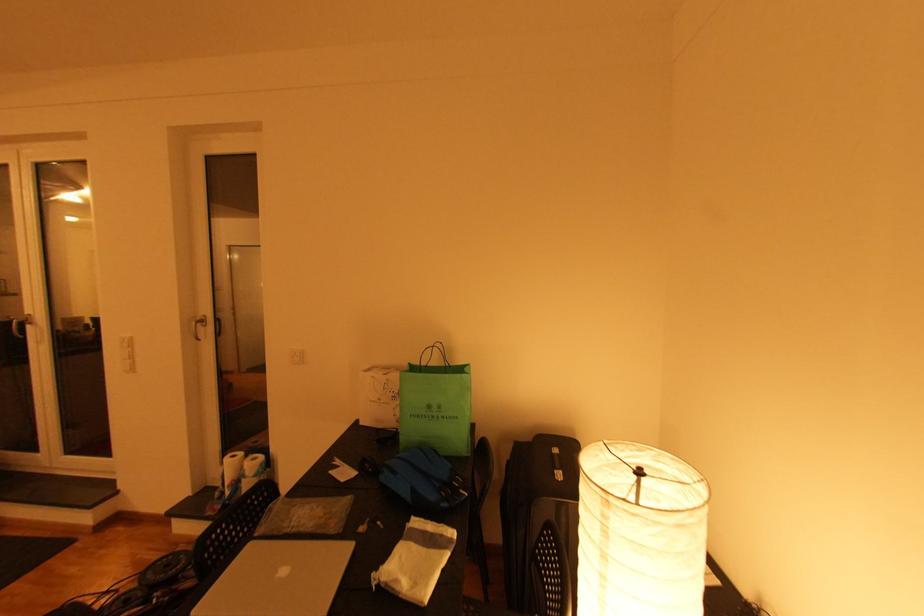
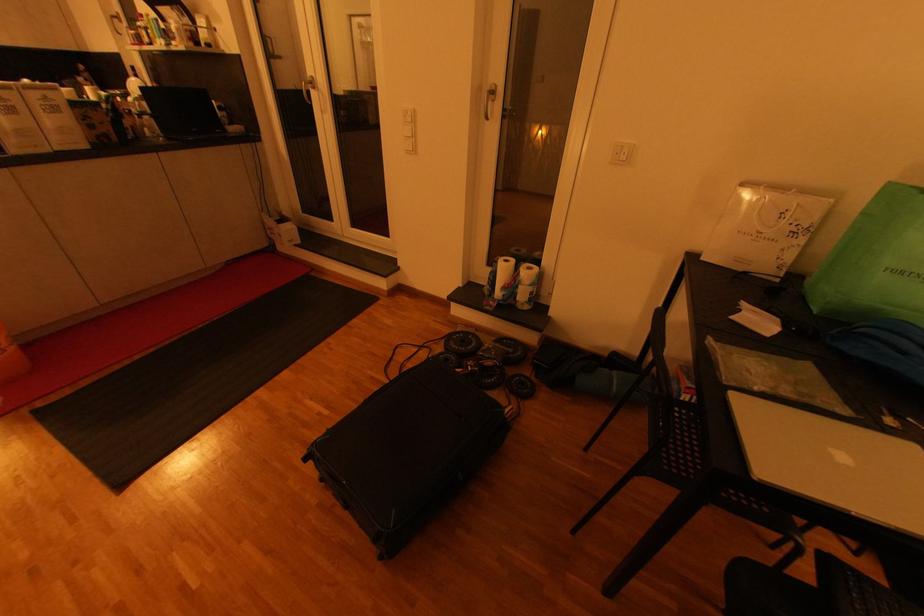
Where in the second image is the point corresponding to pixel 287 572 from the first image?

(845, 458)